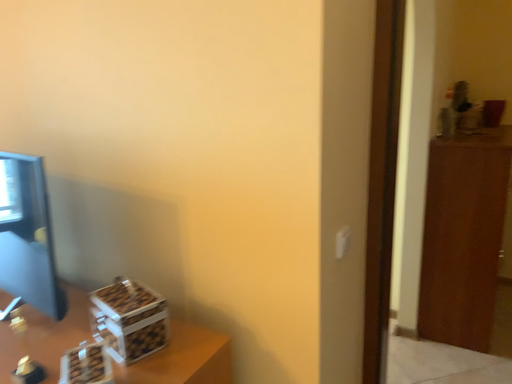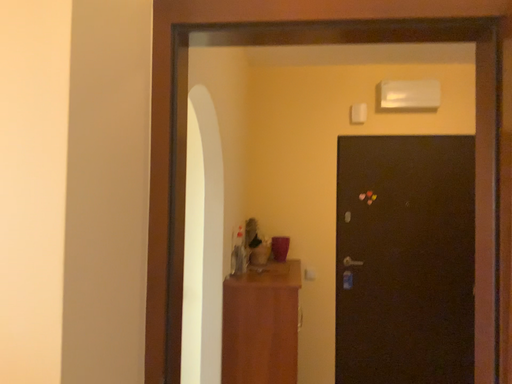
Question: How did the camera likely rotate when shooting the video?

Choices:
 (A) rotated left
 (B) rotated right

Answer: (B)